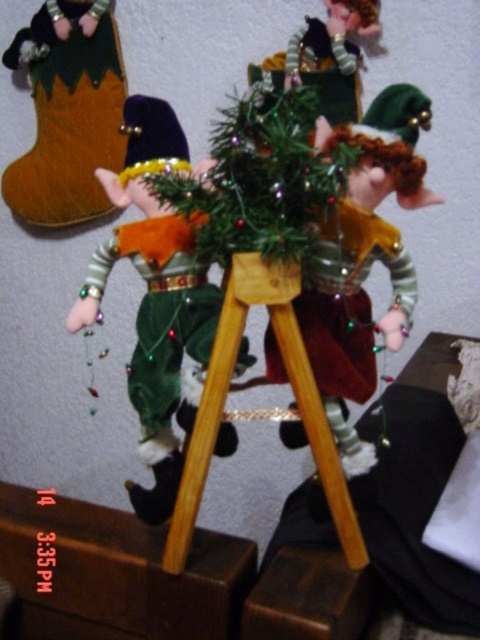
Who is lower down, velvet boot at left or wooden tripod at center?

Positioned lower is wooden tripod at center.

Measure the distance from velvet boot at left to wooden tripod at center.

velvet boot at left and wooden tripod at center are 32.78 inches apart.

Does point (31, 170) come closer to viewer compared to point (170, 524)?

No, (31, 170) is behind (170, 524).

Where is `velvet boot at left`? This screenshot has height=640, width=480. velvet boot at left is located at coordinates (68, 113).

Who is shorter, velvet green elf at left or green velvet christmas tree at center?

Standing shorter between the two is green velvet christmas tree at center.

Which is behind, point (158, 426) or point (206, 253)?

Positioned behind is point (158, 426).

Locate an element on the screen. This screenshot has height=640, width=480. velvet green elf at left is located at coordinates (168, 369).

Which of these two, green velvet christmas tree at center or velvet boot at left, stands taller?

With more height is velvet boot at left.

Does green velvet christmas tree at center appear under velvet boot at left?

Indeed, green velvet christmas tree at center is positioned under velvet boot at left.

Is point (312, 173) closer to viewer compared to point (118, 156)?

That is True.

Identify the location of green velvet christmas tree at center. (261, 177).